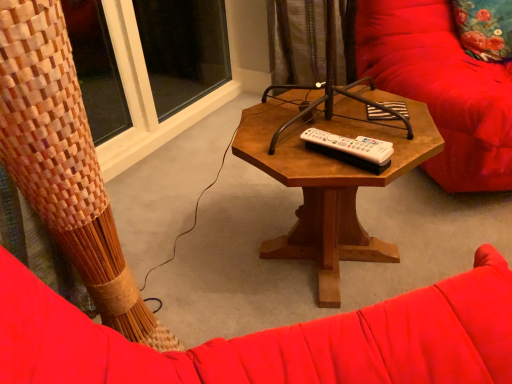
The image size is (512, 384). Identify the location of vacant space to the right of white plastic remote at center. (409, 139).